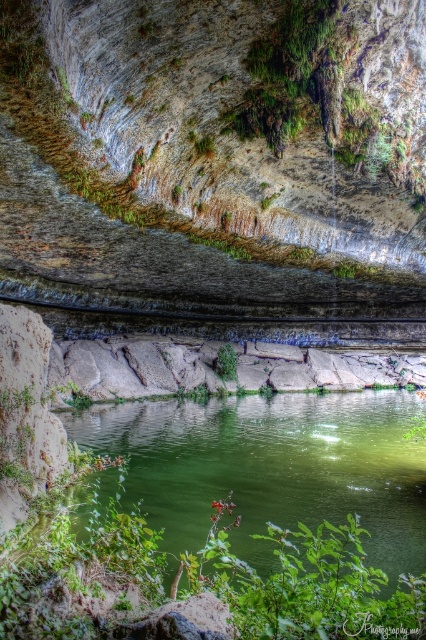
You are a hiker who wants to place a small picnic basket between the green smooth water at center and the green leafy plant at center. Since the basket is 1 meter in length, will it fit between them without overlapping either object?

The distance between the green smooth water at center and the green leafy plant at center is 9.40 meters. Since the picnic basket is only 1 meter long, there is sufficient space to place it between them without overlapping either object.

You are standing at the edge of the water and want to take a photo of both the point at coordinates point [325,122] and point [222,371]. Which point will appear larger in your camera view?

Point [325,122] is closer to the camera than point [222,371], so it will appear larger in the photo.

You are standing at the edge of the water and want to take a photo of the green smooth water at center. If your camera has a focal length of 50mm and you want to capture the entire water surface in the frame, would you need to adjust your position closer or farther away? Explain your reasoning based on the distance provided.

The green smooth water at center is 4.87 meters away from the camera. To capture the entire water surface in the frame with a 50mm focal length, you would need to stay at the current distance or move slightly closer. However, since the exact dimensions of the water surface aren photography, it is recommended to stay at the given distance of 4.87 meters for optimal framing.